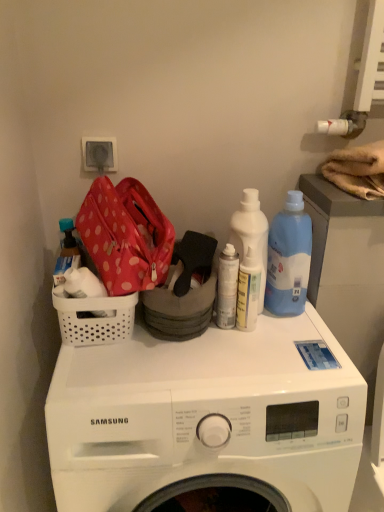
What is the approximate height of translucent plastic bottle at left, the second bottle when ordered from right to left?

The height of translucent plastic bottle at left, the second bottle when ordered from right to left, is 9.44 centimeters.

Looking at this image, measure the distance between white plastic electric outlet at upper left and camera.

white plastic electric outlet at upper left is 3.47 feet away from camera.

Measure the distance between white plastic bottle at center, the second cleaning product viewed from the left, and camera.

A distance of 35.12 inches exists between white plastic bottle at center, the second cleaning product viewed from the left, and camera.

I want to click on white plastic washing machine at center, so click(x=207, y=418).

This screenshot has width=384, height=512. What are the coordinates of `translucent plastic spray bottle at center, which is counted as the 1th cleaning product, starting from the left` in the screenshot? It's located at (248, 292).

I want to click on white plastic basket at left, so click(x=95, y=318).

Locate an element on the screen. This screenshot has width=384, height=512. blue plastic bottle at upper right, which appears as the 3th cleaning product when viewed from the left is located at coordinates (289, 258).

This screenshot has width=384, height=512. I want to click on translucent plastic bottle at left, the second bottle when ordered from right to left, so click(66, 252).

Considering the relative sizes of translucent plastic bottle at left, the 1th bottle positioned from the left, and blue plastic bottle at upper right, which appears as the 3th cleaning product when viewed from the left, in the image provided, is translucent plastic bottle at left, the 1th bottle positioned from the left, wider than blue plastic bottle at upper right, which appears as the 3th cleaning product when viewed from the left,?

No.

From the image's perspective, is translucent plastic bottle at left, the 1th bottle positioned from the left, above or below blue plastic bottle at upper right, which appears as the 3th cleaning product when viewed from the left?

Based on their image positions, translucent plastic bottle at left, the 1th bottle positioned from the left, is located beneath blue plastic bottle at upper right, which appears as the 3th cleaning product when viewed from the left.

Is translucent plastic bottle at left, the 1th bottle positioned from the left, located outside blue plastic bottle at upper right, which appears as the 3th cleaning product when viewed from the left?

translucent plastic bottle at left, the 1th bottle positioned from the left, lies outside blue plastic bottle at upper right, which appears as the 3th cleaning product when viewed from the left,'s area.

From a real-world perspective, which bottle is the 1st one underneath the blue plastic bottle at upper right, which appears as the 3th cleaning product when viewed from the left? Please provide its 2D coordinates.

[(66, 252)]

Between translucent plastic spray bottle at center, which is counted as the third cleaning product, starting from the right, and white plastic bottle at center, acting as the 2th cleaning product starting from the right, which one has larger width?

white plastic bottle at center, acting as the 2th cleaning product starting from the right.

From a real-world perspective, is translucent plastic spray bottle at center, which is counted as the 1th cleaning product, starting from the left, below white plastic bottle at center, acting as the 2th cleaning product starting from the right?

Indeed, from a real-world perspective, translucent plastic spray bottle at center, which is counted as the 1th cleaning product, starting from the left, is positioned beneath white plastic bottle at center, acting as the 2th cleaning product starting from the right.

In the image, there is a white plastic bottle at center, the second cleaning product viewed from the left. Identify the location of cleaning product below it (from a real-world perspective). The height and width of the screenshot is (512, 384). (248, 292).

Locate an element on the screen. basket in front of the translucent plastic spray bottle at center, which is counted as the 1th cleaning product, starting from the left is located at coordinates (95, 318).

Between point (258, 264) and point (131, 332), which one is positioned behind?

The point (131, 332) is behind.

From a real-world perspective, is translucent plastic spray bottle at center, which is counted as the 1th cleaning product, starting from the left, under white plastic basket at left?

Yes.

How different are the orientations of translucent plastic spray bottle at center, which is counted as the third cleaning product, starting from the right, and white plastic basket at left in degrees?

The facing directions of translucent plastic spray bottle at center, which is counted as the third cleaning product, starting from the right, and white plastic basket at left are 0.00184 degrees apart.

Based on the photo, which of these two, blue plastic bottle at upper right, which appears as the 3th cleaning product when viewed from the left, or white plastic bottle at center, acting as the 2th cleaning product starting from the right, is smaller?

white plastic bottle at center, acting as the 2th cleaning product starting from the right, is smaller.

Which of these two, blue plastic bottle at upper right, acting as the 1th cleaning product starting from the right, or white plastic bottle at center, the second cleaning product viewed from the left, is thinner?

white plastic bottle at center, the second cleaning product viewed from the left.

You are a GUI agent. You are given a task and a screenshot of the screen. Output one action in this format:
    pyautogui.click(x=<x>, y=<y>)
    Task: Click on the 1st cleaning product located beneath the blue plastic bottle at upper right, acting as the 1th cleaning product starting from the right (from a real-world perspective)
    The height and width of the screenshot is (512, 384).
    Given the screenshot: What is the action you would take?
    pyautogui.click(x=251, y=234)

From the image's perspective, is white plastic washing machine at center under white plastic basket at left?

Correct, white plastic washing machine at center appears lower than white plastic basket at left in the image.

Does point (144, 331) come farther from viewer compared to point (122, 300)?

Yes.

Considering the sizes of objects white plastic washing machine at center and white plastic basket at left in the image provided, who is taller, white plastic washing machine at center or white plastic basket at left?

With more height is white plastic washing machine at center.

Could you tell me if white plastic washing machine at center is turned towards white plastic basket at left?

No, white plastic washing machine at center does not turn towards white plastic basket at left.

Does white plastic basket at left come behind translucent plastic bottle at left, the 1th bottle positioned from the left?

No, it is in front of translucent plastic bottle at left, the 1th bottle positioned from the left.

Does white plastic basket at left touch translucent plastic bottle at left, the 1th bottle positioned from the left?

white plastic basket at left and translucent plastic bottle at left, the 1th bottle positioned from the left, are clearly separated.

Does white plastic basket at left have a lesser width compared to translucent plastic bottle at left, the second bottle when ordered from right to left?

In fact, white plastic basket at left might be wider than translucent plastic bottle at left, the second bottle when ordered from right to left.

Which of these two, white plastic basket at left or translucent plastic bottle at left, the second bottle when ordered from right to left, is bigger?

Bigger between the two is white plastic basket at left.

Which object is closer to the camera, white plastic basket at left or white matte spray can at center, the 2th bottle viewed from the left?

white plastic basket at left.

Is white plastic basket at left placed right next to white matte spray can at center, the first bottle in the right-to-left sequence?

No, white plastic basket at left is not next to white matte spray can at center, the first bottle in the right-to-left sequence.

Does white plastic basket at left have a greater height compared to white matte spray can at center, the 2th bottle viewed from the left?

In fact, white plastic basket at left may be shorter than white matte spray can at center, the 2th bottle viewed from the left.

Does white plastic basket at left turn towards white matte spray can at center, the 2th bottle viewed from the left?

No, white plastic basket at left is not facing towards white matte spray can at center, the 2th bottle viewed from the left.

Image resolution: width=384 pixels, height=512 pixels. I want to click on bottle that is the 1st one below the blue plastic bottle at upper right, acting as the 1th cleaning product starting from the right (from a real-world perspective), so click(x=66, y=252).

Which cleaning product is the 2nd one when counting from the back of the translucent plastic spray bottle at center, which is counted as the 1th cleaning product, starting from the left? Please provide its 2D coordinates.

[(251, 234)]

Considering their positions, is white plastic washing machine at center positioned further to translucent plastic spray bottle at center, which is counted as the 1th cleaning product, starting from the left, than white plastic electric outlet at upper left?

white plastic electric outlet at upper left is positioned further to the anchor translucent plastic spray bottle at center, which is counted as the 1th cleaning product, starting from the left.

Which object lies nearer to the anchor point white matte spray can at center, the 2th bottle viewed from the left, translucent plastic bottle at left, the 1th bottle positioned from the left, or translucent plastic spray bottle at center, which is counted as the 1th cleaning product, starting from the left?

translucent plastic spray bottle at center, which is counted as the 1th cleaning product, starting from the left, lies closer to white matte spray can at center, the 2th bottle viewed from the left, than the other object.

Which object lies nearer to the anchor point white matte spray can at center, the 2th bottle viewed from the left, blue plastic bottle at upper right, which appears as the 3th cleaning product when viewed from the left, or translucent plastic bottle at left, the 1th bottle positioned from the left?

blue plastic bottle at upper right, which appears as the 3th cleaning product when viewed from the left.

Considering their positions, is white plastic electric outlet at upper left positioned further to translucent plastic spray bottle at center, which is counted as the third cleaning product, starting from the right, than white plastic basket at left?

white plastic electric outlet at upper left is further to translucent plastic spray bottle at center, which is counted as the third cleaning product, starting from the right.

Considering their positions, is translucent plastic spray bottle at center, which is counted as the third cleaning product, starting from the right, positioned closer to white plastic bottle at center, acting as the 2th cleaning product starting from the right, than white matte spray can at center, the 2th bottle viewed from the left?

translucent plastic spray bottle at center, which is counted as the third cleaning product, starting from the right, is positioned closer to the anchor white plastic bottle at center, acting as the 2th cleaning product starting from the right.

Which object lies nearer to the anchor point translucent plastic bottle at left, the 1th bottle positioned from the left, white plastic bottle at center, the second cleaning product viewed from the left, or white plastic basket at left?

white plastic basket at left is closer to translucent plastic bottle at left, the 1th bottle positioned from the left.

From the image, which object appears to be farther from white plastic basket at left, translucent plastic bottle at left, the 1th bottle positioned from the left, or white plastic bottle at center, the second cleaning product viewed from the left?

white plastic bottle at center, the second cleaning product viewed from the left, is further to white plastic basket at left.

Considering their positions, is white plastic washing machine at center positioned closer to translucent plastic spray bottle at center, which is counted as the third cleaning product, starting from the right, than white matte spray can at center, the first bottle in the right-to-left sequence?

Based on the image, white matte spray can at center, the first bottle in the right-to-left sequence, appears to be nearer to translucent plastic spray bottle at center, which is counted as the third cleaning product, starting from the right.

Where is `basket situated between white plastic electric outlet at upper left and blue plastic bottle at upper right, which appears as the 3th cleaning product when viewed from the left, from left to right`? Image resolution: width=384 pixels, height=512 pixels. basket situated between white plastic electric outlet at upper left and blue plastic bottle at upper right, which appears as the 3th cleaning product when viewed from the left, from left to right is located at coordinates (95, 318).

Locate an element on the screen. bottle between translucent plastic bottle at left, the 1th bottle positioned from the left, and translucent plastic spray bottle at center, which is counted as the third cleaning product, starting from the right is located at coordinates coord(227,287).

Locate an element on the screen. The height and width of the screenshot is (512, 384). basket between translucent plastic bottle at left, the second bottle when ordered from right to left, and white plastic bottle at center, acting as the 2th cleaning product starting from the right, in the horizontal direction is located at coordinates (95, 318).

The width and height of the screenshot is (384, 512). What are the coordinates of `basket between white plastic electric outlet at upper left and white plastic washing machine at center vertically` in the screenshot? It's located at (95, 318).